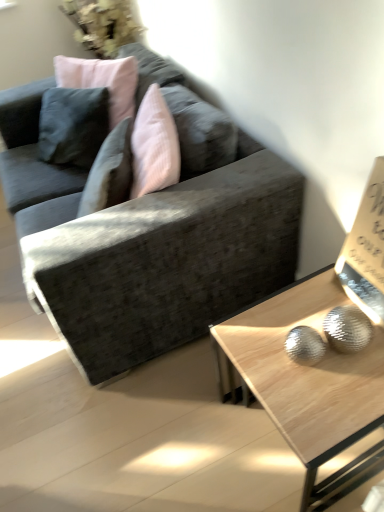
Question: Is light wood/texture coffee table at lower right inside the boundaries of textured gray couch at center, or outside?

Choices:
 (A) inside
 (B) outside

Answer: (B)

Question: Is point (314, 437) positioned closer to the camera than point (145, 234)?

Choices:
 (A) farther
 (B) closer

Answer: (B)

Question: Which of these objects is positioned closest to the textured gray couch at center?

Choices:
 (A) white paper at upper right
 (B) light wood/texture coffee table at lower right

Answer: (B)

Question: Considering the real-world distances, which object is closest to the textured gray couch at center?

Choices:
 (A) white paper at upper right
 (B) light wood/texture coffee table at lower right

Answer: (B)